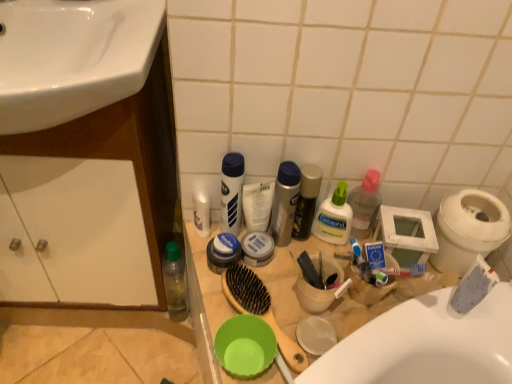
In order to click on vacant region to the right of matte white cream container at center, acting as the fourth toiletry starting from the left in this screenshot , I will do `click(308, 264)`.